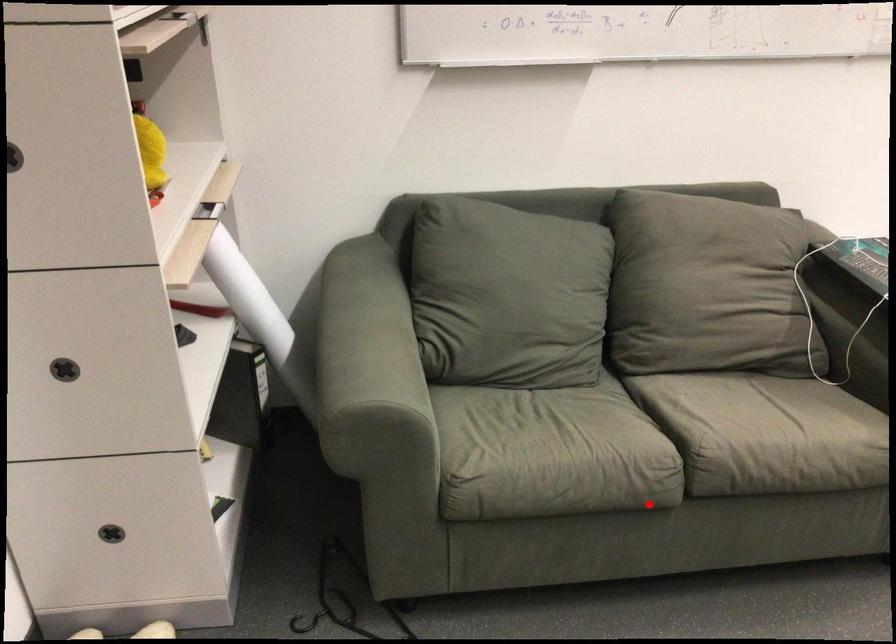
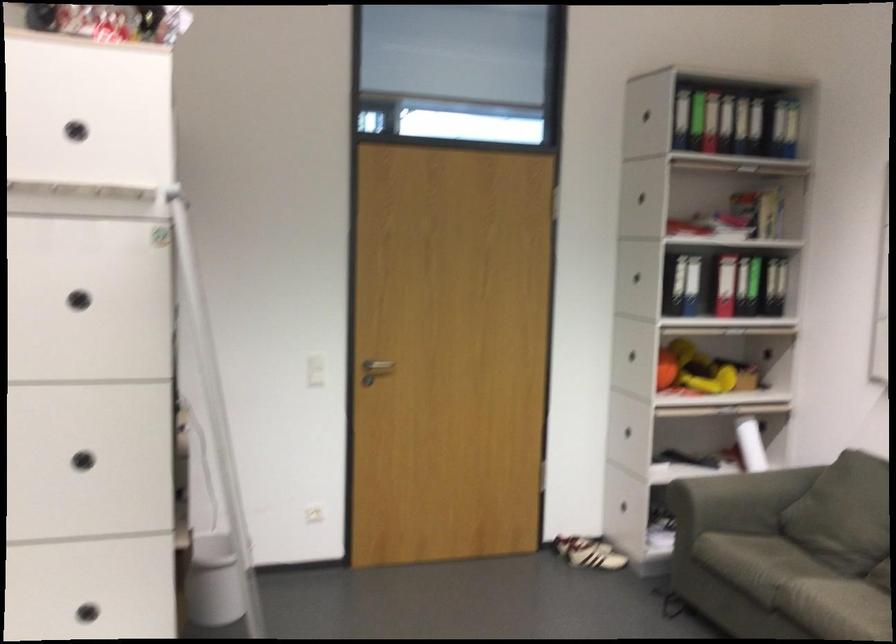
Find the pixel in the second image that matches the highlighted location in the first image.

(771, 623)